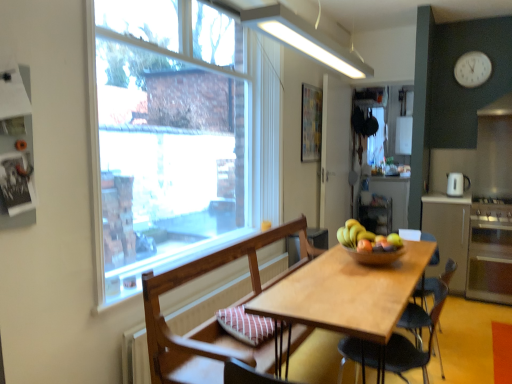
Question: From a real-world perspective, does clear glass window at upper left sit lower than white glossy refrigerator at upper right?

Choices:
 (A) no
 (B) yes

Answer: (B)

Question: Considering the relative sizes of clear glass window at upper left and white glossy refrigerator at upper right in the image provided, is clear glass window at upper left taller than white glossy refrigerator at upper right?

Choices:
 (A) no
 (B) yes

Answer: (B)

Question: Does clear glass window at upper left turn towards white glossy refrigerator at upper right?

Choices:
 (A) no
 (B) yes

Answer: (A)

Question: Considering the relative sizes of clear glass window at upper left and white glossy refrigerator at upper right in the image provided, is clear glass window at upper left thinner than white glossy refrigerator at upper right?

Choices:
 (A) yes
 (B) no

Answer: (A)

Question: From the image's perspective, does clear glass window at upper left appear lower than white glossy refrigerator at upper right?

Choices:
 (A) no
 (B) yes

Answer: (B)

Question: Considering the positions of wooden chair with cushion at center, positioned as the second chair in back-to-front order, and white glossy coffee machine at right in the image, is wooden chair with cushion at center, positioned as the second chair in back-to-front order, taller or shorter than white glossy coffee machine at right?

Choices:
 (A) tall
 (B) short

Answer: (A)

Question: From a real-world perspective, is wooden chair with cushion at center, which ranks as the first chair in front-to-back order, positioned above or below white glossy coffee machine at right?

Choices:
 (A) below
 (B) above

Answer: (A)

Question: From the image's perspective, is wooden chair with cushion at center, positioned as the second chair in back-to-front order, located above or below white glossy coffee machine at right?

Choices:
 (A) below
 (B) above

Answer: (A)

Question: In terms of width, does wooden chair with cushion at center, which ranks as the first chair in front-to-back order, look wider or thinner when compared to white glossy coffee machine at right?

Choices:
 (A) thin
 (B) wide

Answer: (B)

Question: In terms of height, does white glossy refrigerator at upper right look taller or shorter compared to red matte apple at center?

Choices:
 (A) short
 (B) tall

Answer: (B)

Question: From the image's perspective, relative to red matte apple at center, is white glossy refrigerator at upper right above or below?

Choices:
 (A) above
 (B) below

Answer: (A)

Question: Considering the positions of white glossy refrigerator at upper right and red matte apple at center in the image, is white glossy refrigerator at upper right wider or thinner than red matte apple at center?

Choices:
 (A) wide
 (B) thin

Answer: (A)

Question: Is point (410, 150) positioned closer to the camera than point (371, 249)?

Choices:
 (A) farther
 (B) closer

Answer: (A)

Question: Is point coord(467,253) positioned closer to the camera than point coord(466,233)?

Choices:
 (A) closer
 (B) farther

Answer: (B)

Question: Is satin silver oven at right in front of or behind matte white cabinet at right in the image?

Choices:
 (A) behind
 (B) front

Answer: (B)